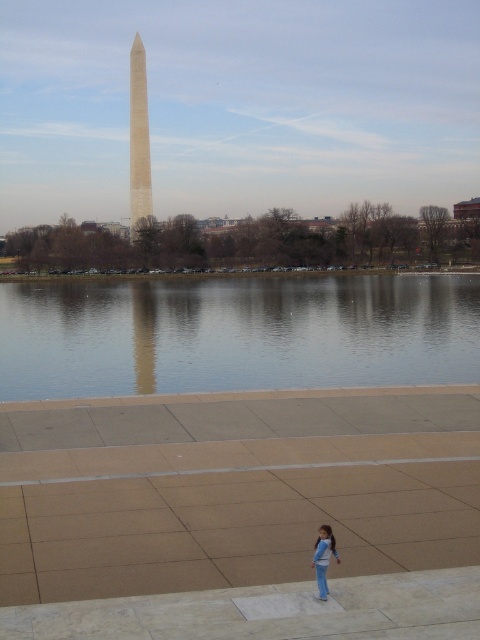
Question: Does smooth reflective water at center have a lesser width compared to smooth white obelisk at center?

Choices:
 (A) yes
 (B) no

Answer: (B)

Question: Where is smooth reflective water at center located in relation to blue denim jeans at lower center in the image?

Choices:
 (A) above
 (B) below

Answer: (A)

Question: Based on their relative distances, which object is nearer to the blue denim jeans at lower center?

Choices:
 (A) smooth white obelisk at center
 (B) smooth reflective water at center

Answer: (B)

Question: Which of these objects is positioned farthest from the smooth white obelisk at center?

Choices:
 (A) blue denim jeans at lower center
 (B) smooth reflective water at center

Answer: (A)

Question: Which object is closer to the camera taking this photo?

Choices:
 (A) smooth reflective water at center
 (B) blue denim jeans at lower center
 (C) smooth white obelisk at center

Answer: (B)

Question: Does smooth reflective water at center have a larger size compared to smooth white obelisk at center?

Choices:
 (A) yes
 (B) no

Answer: (B)